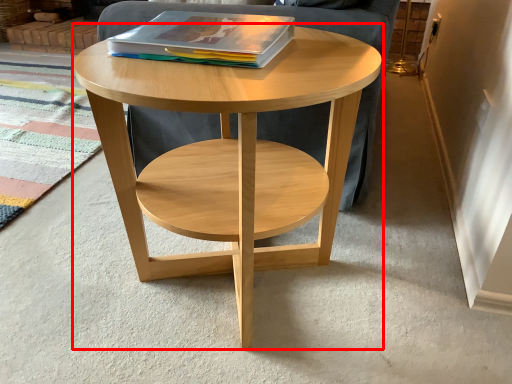
Question: Considering the relative positions of coffee table (annotated by the red box) and magazine in the image provided, where is coffee table (annotated by the red box) located with respect to the staircase?

Choices:
 (A) left
 (B) right

Answer: (B)